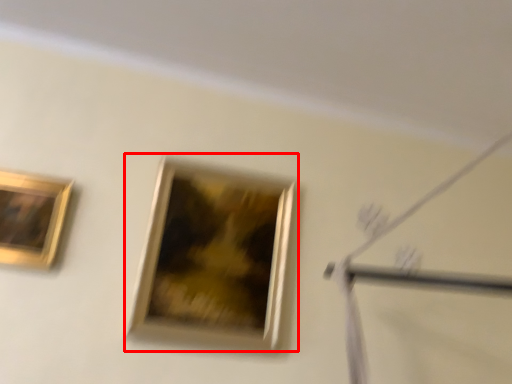
Question: Considering the relative positions of picture frame (annotated by the red box) and picture frame in the image provided, where is picture frame (annotated by the red box) located with respect to the staircase?

Choices:
 (A) right
 (B) left

Answer: (A)